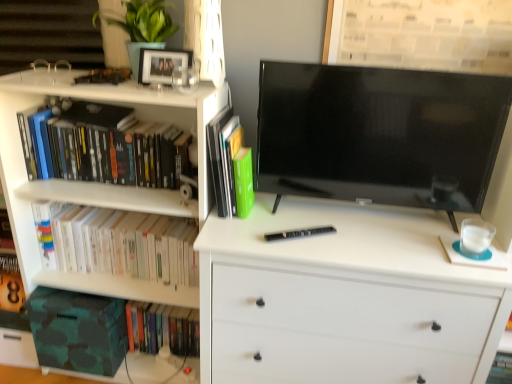
Find the location of a particular element. The width and height of the screenshot is (512, 384). vacant area that lies between green matte book at center, which is the third book from bottom to top, and black glossy tv at center is located at coordinates (312, 220).